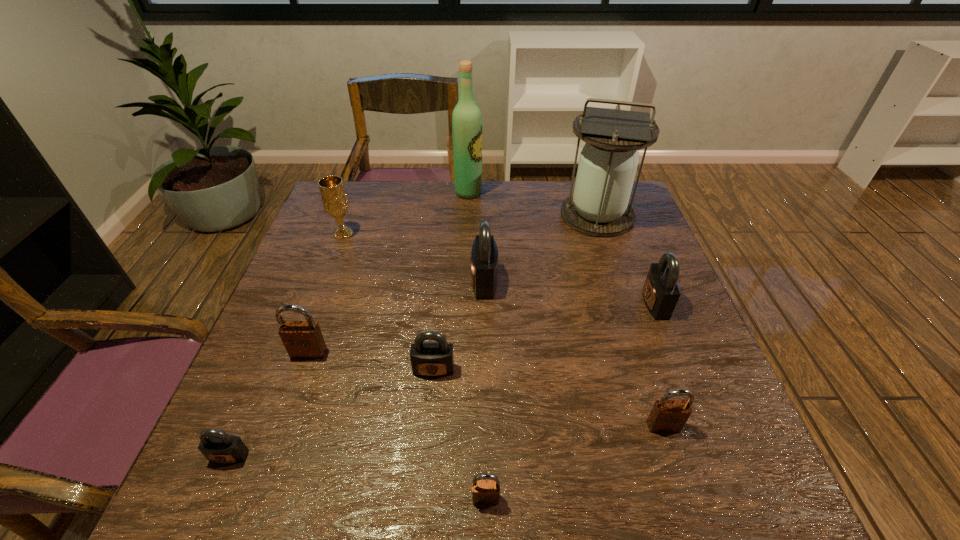
You are a GUI agent. You are given a task and a screenshot of the screen. Output one action in this format:
    pyautogui.click(x=<x>, y=<y>)
    Task: Click on the wine bottle
    Image resolution: width=960 pixels, height=540 pixels.
    Given the screenshot: What is the action you would take?
    pyautogui.click(x=466, y=118)

Identify the location of lantern. Image resolution: width=960 pixels, height=540 pixels. (599, 206).

I want to click on the third gray padlock from left to right, so click(x=484, y=256).

Where is `the biggest gray padlock`? the biggest gray padlock is located at coordinates (484, 256).

Locate an element on the screen. Image resolution: width=960 pixels, height=540 pixels. chalice is located at coordinates (334, 198).

Identify the location of the rightmost padlock. This screenshot has width=960, height=540. (661, 291).

Find the location of a particular element. The image size is (960, 540). the rightmost gray padlock is located at coordinates (661, 291).

This screenshot has width=960, height=540. Identify the location of the biggest brown padlock. (302, 339).

At what (x,y) coordinates should I click in order to perform the action: click on the third farthest padlock. Please return your answer as a coordinate pair (x, y). Image resolution: width=960 pixels, height=540 pixels. Looking at the image, I should click on (302, 339).

This screenshot has width=960, height=540. Find the location of `the second biggest brown padlock`. the second biggest brown padlock is located at coordinates (667, 416).